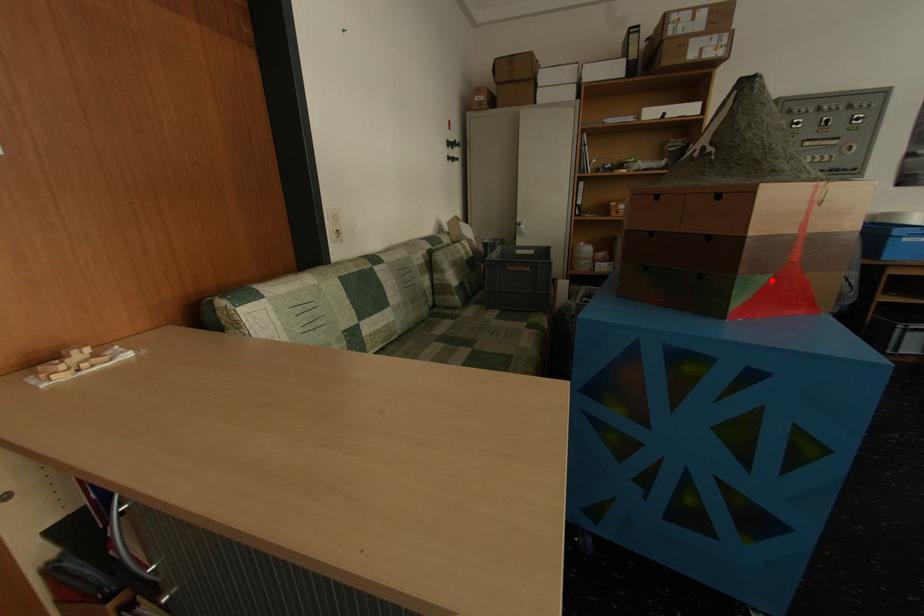
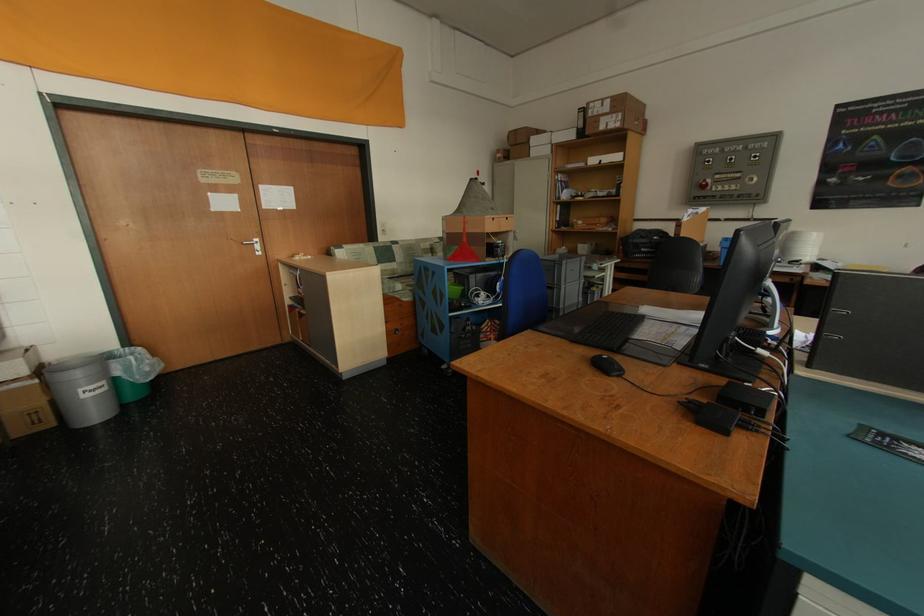
Question: A red point is marked in image1. In image2, is the corresponding 3D point closer to the camera or farther? Reply with the corresponding letter.

Choices:
 (A) The corresponding 3D point is closer.
 (B) The corresponding 3D point is farther.

Answer: (A)